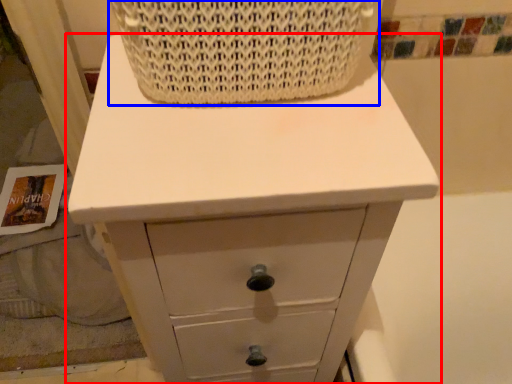
Question: Which object appears farthest to the camera in this image, chest of drawers (highlighted by a red box) or basket (highlighted by a blue box)?

Choices:
 (A) chest of drawers
 (B) basket

Answer: (A)